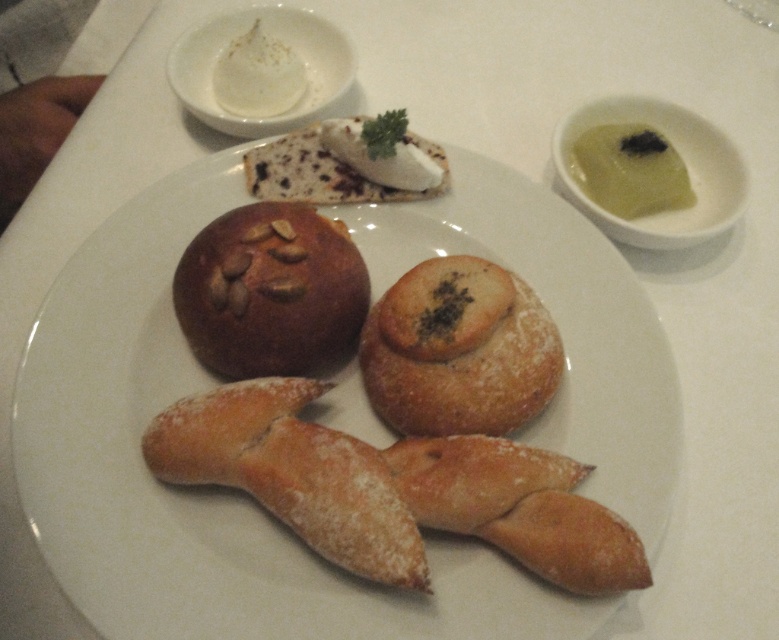
Looking at this image, you are a baker who wants to stack the powdered sugar bread at center and the brown crusty bread at center on top of each other. Which bread should be placed at the bottom to ensure stability?

The powdered sugar bread at center has a lesser height compared to brown crusty bread at center, so to ensure stability, the brown crusty bread at center should be placed at the bottom as it is taller and provides a stable base.